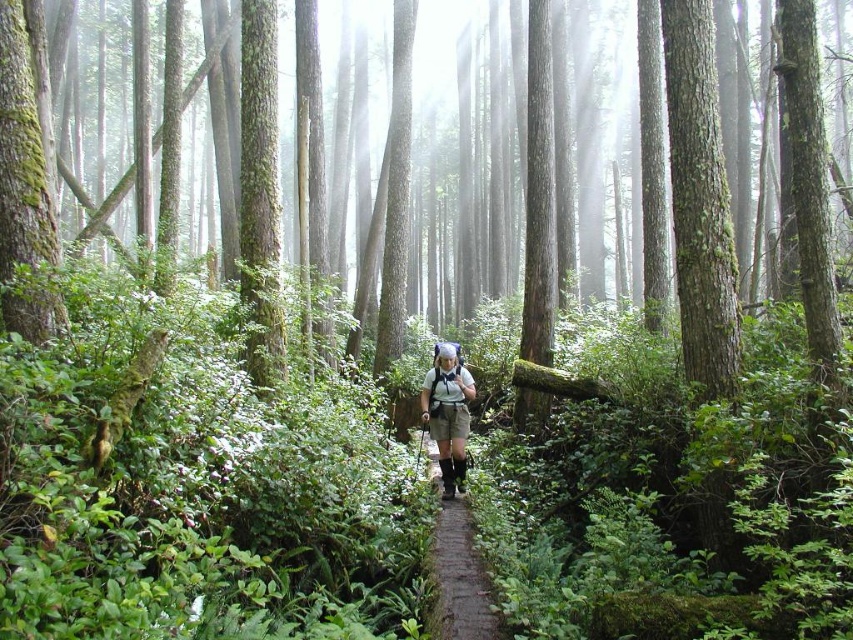
Is point (445, 570) positioned in front of point (451, 385)?

Yes, point (445, 570) is closer to viewer.

Is brown dirt path at center wider than khaki fabric shorts at center?

No.

Is point (467, 522) closer to camera compared to point (445, 372)?

That is True.

Identify the location of brown dirt path at center. Image resolution: width=853 pixels, height=640 pixels. pyautogui.click(x=459, y=579).